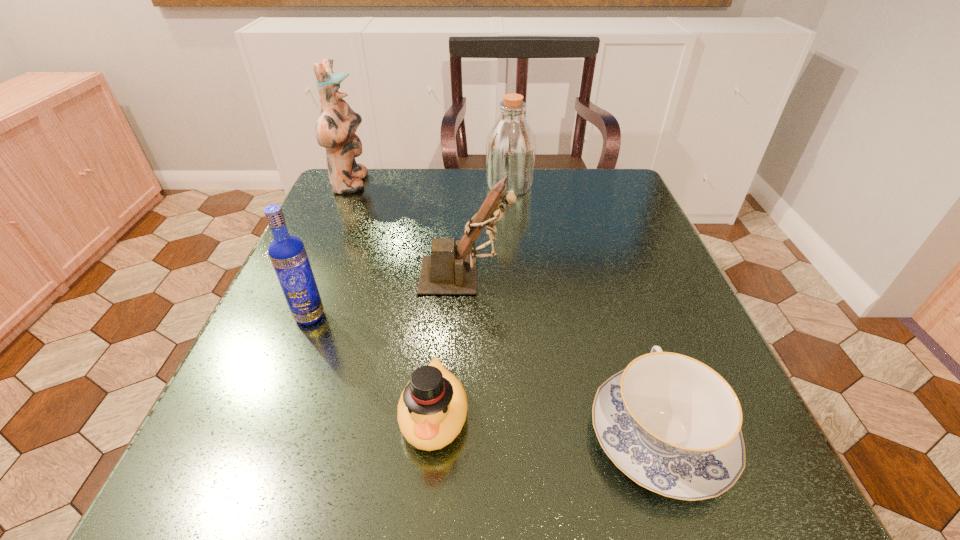
The width and height of the screenshot is (960, 540). Identify the location of empty space between the vodka and the bottle. (409, 251).

Identify which object is located as the fifth nearest to the chinaware. Please provide its 2D coordinates. Your answer should be formatted as a tuple, i.e. [(x, y)], where the tuple contains the x and y coordinates of a point satisfying the conditions above.

[(335, 129)]

Identify which object is the third closest to the tallest object. Please provide its 2D coordinates. Your answer should be formatted as a tuple, i.e. [(x, y)], where the tuple contains the x and y coordinates of a point satisfying the conditions above.

[(288, 255)]

This screenshot has height=540, width=960. I want to click on vacant region that satisfies the following two spatial constraints: 1. on the front-facing side of the nearer figurine; 2. with the handle on the side of the chinaware, so click(x=461, y=435).

This screenshot has width=960, height=540. What are the coordinates of `free space that satisfies the following two spatial constraints: 1. with the handle on the side of the chinaware; 2. on the front-facing side of the fourth nearest object` in the screenshot? It's located at (607, 276).

Where is `vacant area in the image that satisfies the following two spatial constraints: 1. on the front-facing side of the bottle; 2. on the right side of the farther figurine`? This screenshot has height=540, width=960. vacant area in the image that satisfies the following two spatial constraints: 1. on the front-facing side of the bottle; 2. on the right side of the farther figurine is located at coordinates (350, 186).

Where is `vacant space that satisfies the following two spatial constraints: 1. on the front-facing side of the farther figurine; 2. on the back side of the fourth farthest object`? vacant space that satisfies the following two spatial constraints: 1. on the front-facing side of the farther figurine; 2. on the back side of the fourth farthest object is located at coordinates (293, 316).

Find the location of a particular element. The width and height of the screenshot is (960, 540). vacant position in the image that satisfies the following two spatial constraints: 1. on the front side of the bottle; 2. on the front-facing side of the nearer figurine is located at coordinates (518, 276).

Identify the location of vacant space that satisfies the following two spatial constraints: 1. on the front-facing side of the fourth nearest object; 2. on the front side of the vodka. pos(465,316).